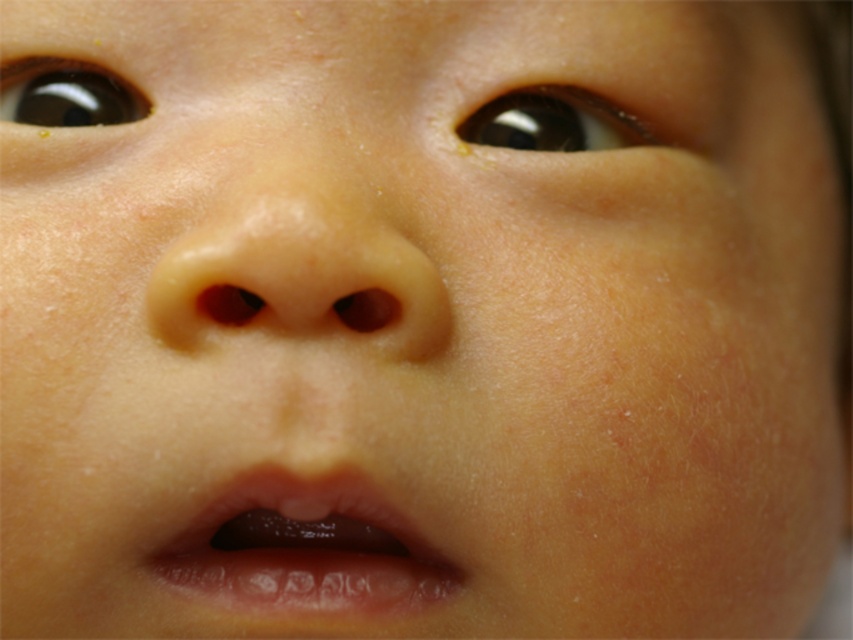
Question: Can you confirm if brown glossy eye at upper center is thinner than brown shiny eye at upper left?

Choices:
 (A) yes
 (B) no

Answer: (B)

Question: Can you confirm if translucent plastic teeth at lower center is smaller than brown glossy eye at upper center?

Choices:
 (A) no
 (B) yes

Answer: (A)

Question: Which is nearer to the brown glossy eye at upper center?

Choices:
 (A) smooth flesh-colored nose at center
 (B) translucent plastic teeth at lower center

Answer: (A)

Question: Is brown glossy eye at upper center smaller than brown shiny eye at upper left?

Choices:
 (A) no
 (B) yes

Answer: (A)

Question: Which object is positioned closest to the brown shiny eye at upper left?

Choices:
 (A) brown glossy eye at upper center
 (B) smooth flesh-colored nose at center

Answer: (B)

Question: Which point is farther to the camera?

Choices:
 (A) (560, 128)
 (B) (10, 96)
 (C) (215, 500)
 (D) (308, 260)

Answer: (A)